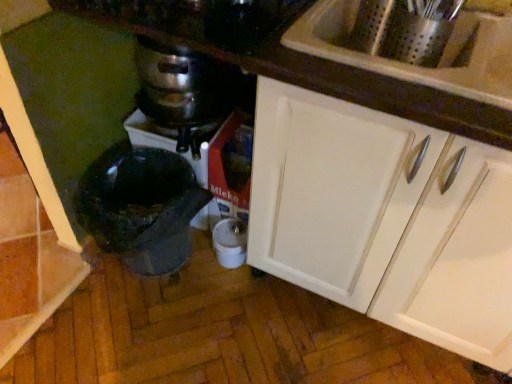
Locate an element on the screen. The image size is (512, 384). blank area to the left of white plastic container at lower center, marked as the 2th appliance in a left-to-right arrangement is located at coordinates (189, 261).